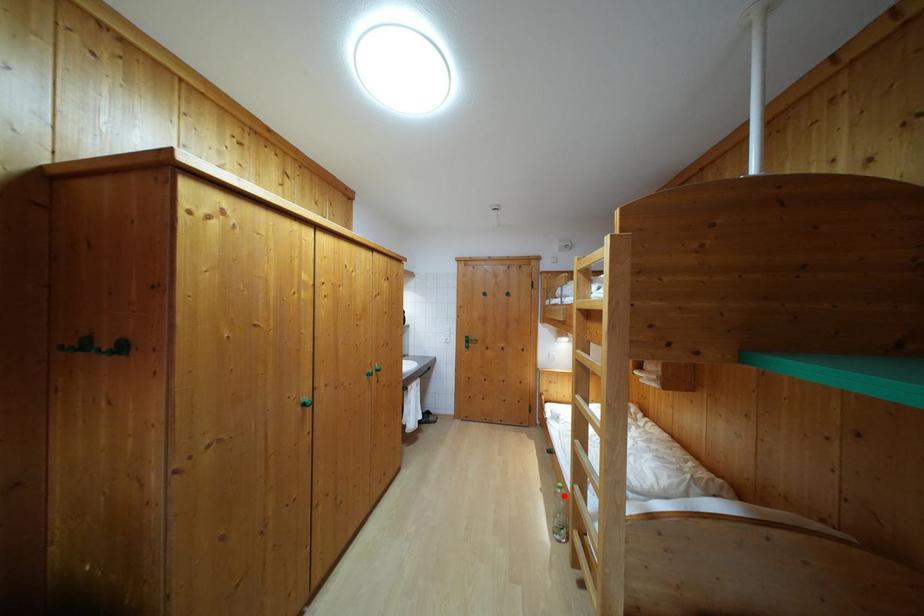
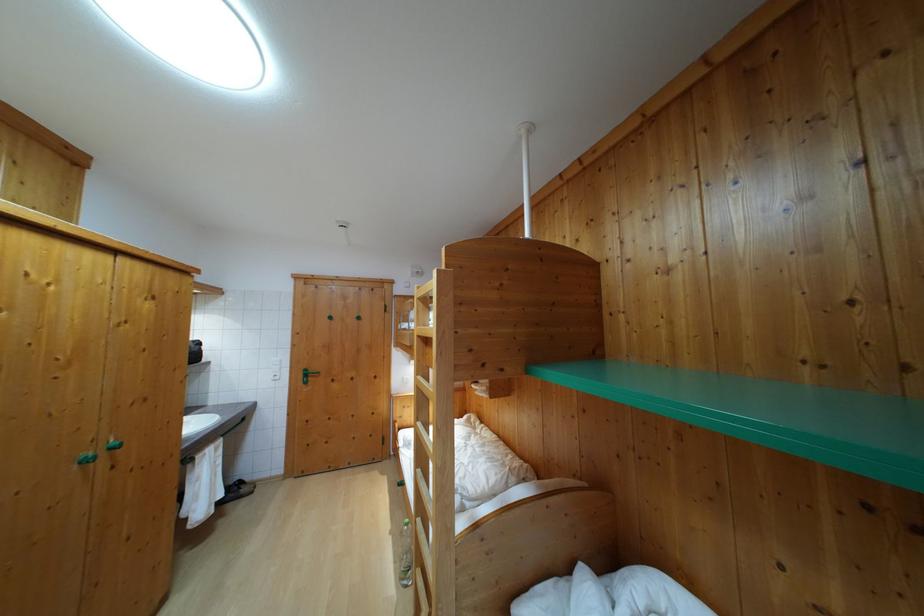
Question: A red point is marked in image1. In image2, is the corresponding 3D point closer to the camera or farther? Reply with the corresponding letter.

Choices:
 (A) The corresponding 3D point is closer.
 (B) The corresponding 3D point is farther.

Answer: (B)